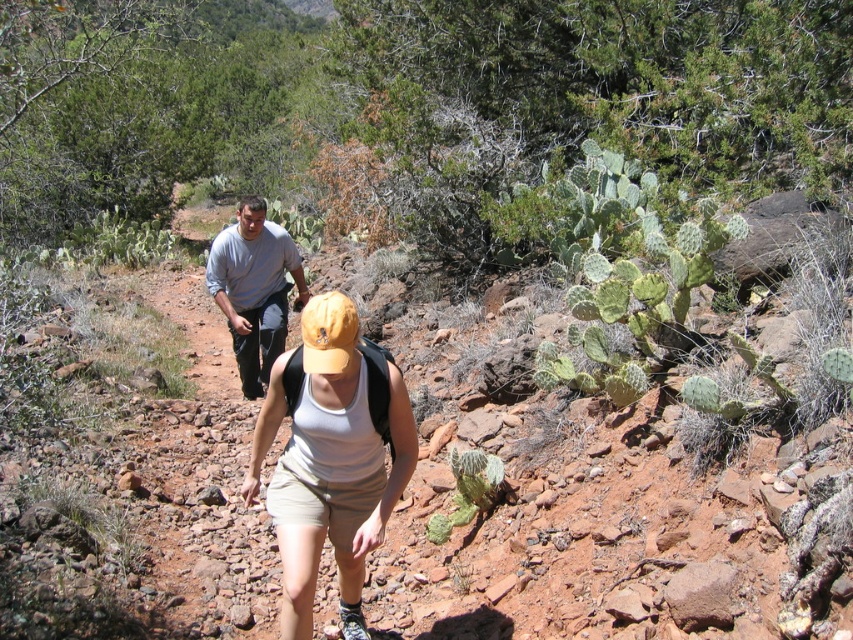
Does gray cotton shirt at upper left come in front of gray fabric pants at center?

Yes, it is in front of gray fabric pants at center.

Who is higher up, gray cotton shirt at upper left or gray fabric pants at center?

gray fabric pants at center is above.

Between point (378, 504) and point (283, 236), which one is positioned behind?

The point (283, 236) is more distant.

The image size is (853, 640). I want to click on gray cotton shirt at upper left, so click(x=331, y=458).